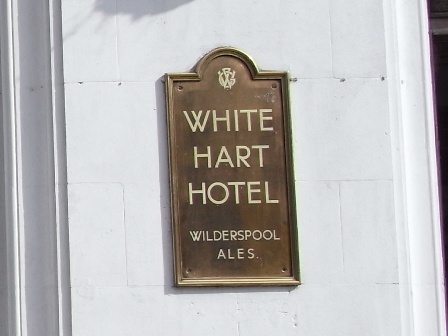
At what (x,y) coordinates should I click in order to perform the action: click on molding. Please return your answer as a coordinate pair (x, y). The height and width of the screenshot is (336, 448). Looking at the image, I should click on (30, 275).